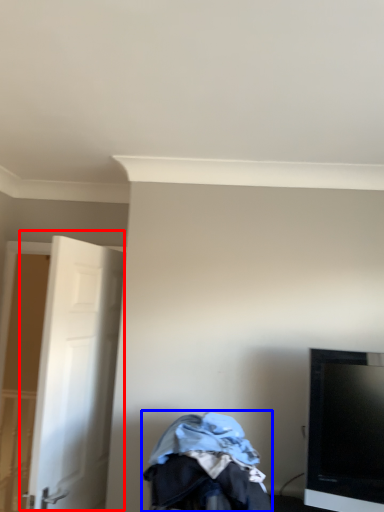
Question: Which of the following is the farthest to the observer, door (highlighted by a red box) or baby carriage (highlighted by a blue box)?

Choices:
 (A) door
 (B) baby carriage

Answer: (A)